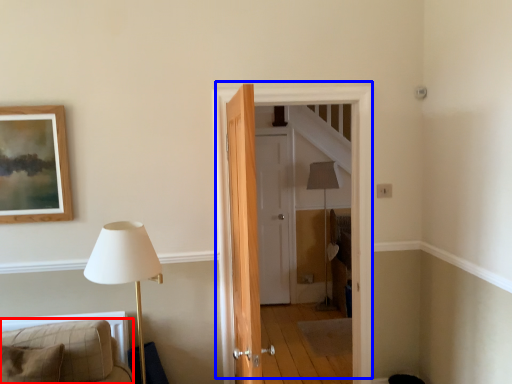
Question: Among these objects, which one is nearest to the camera, furniture (highlighted by a red box) or door (highlighted by a blue box)?

Choices:
 (A) furniture
 (B) door

Answer: (A)